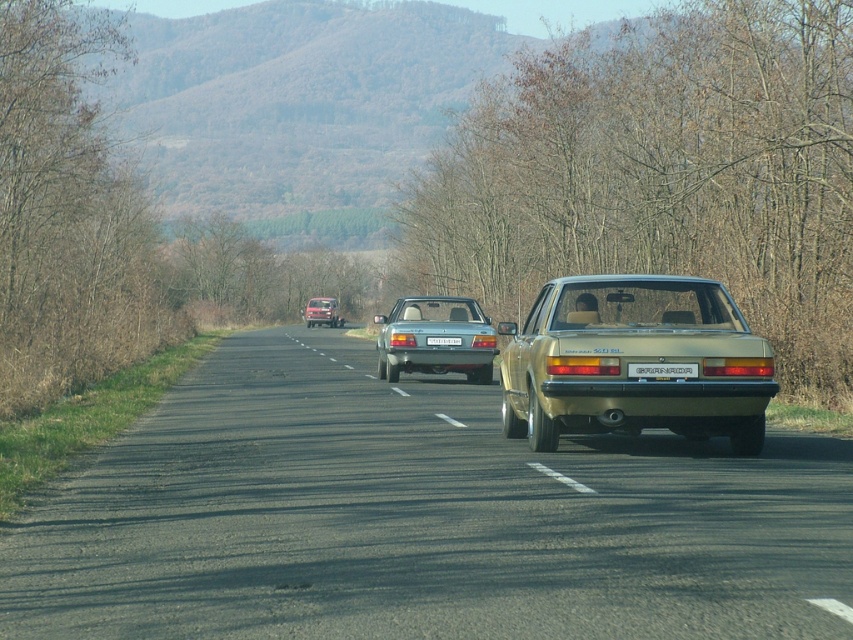
Looking at this image, you are standing at the starting point of the road and want to reach the asphalt road at center. According to the coordinates provided, in which direction should you walk to reach it?

The asphalt road at center is located at coordinates point (416, 518). Since you are at the starting point, you should walk forward along the road towards the center to reach it.

You are a driver approaching the road with three vehicles. You see a white plastic license plate at rear. Where is it located in the image?

The white plastic license plate at rear is located at point (662, 369) in the image.

You are standing on the side of the road in this rural scene. If you look at the point with coordinates (416, 518), what surface are you looking at?

The point at coordinates (416, 518) corresponds to the asphalt road at center, so you are looking at the asphalt road surface.